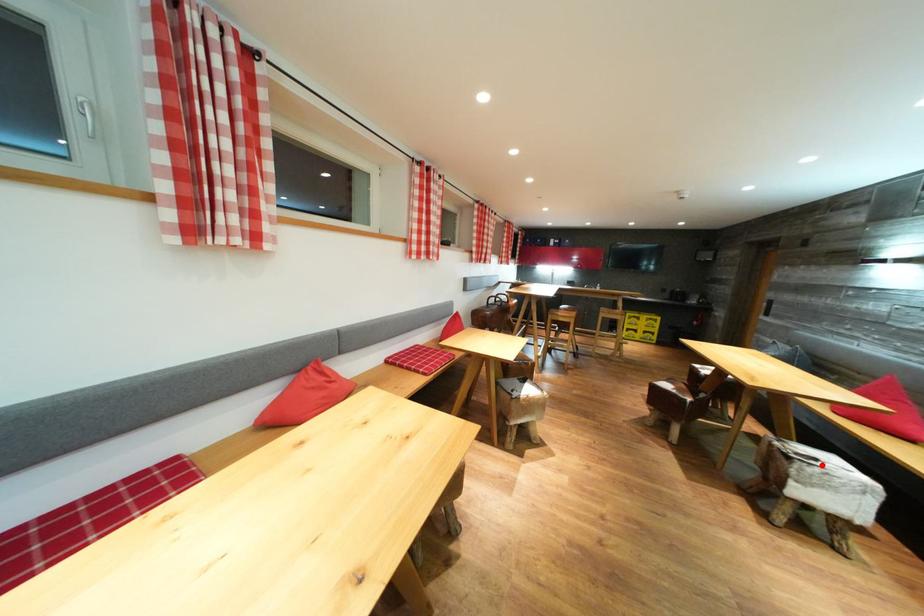
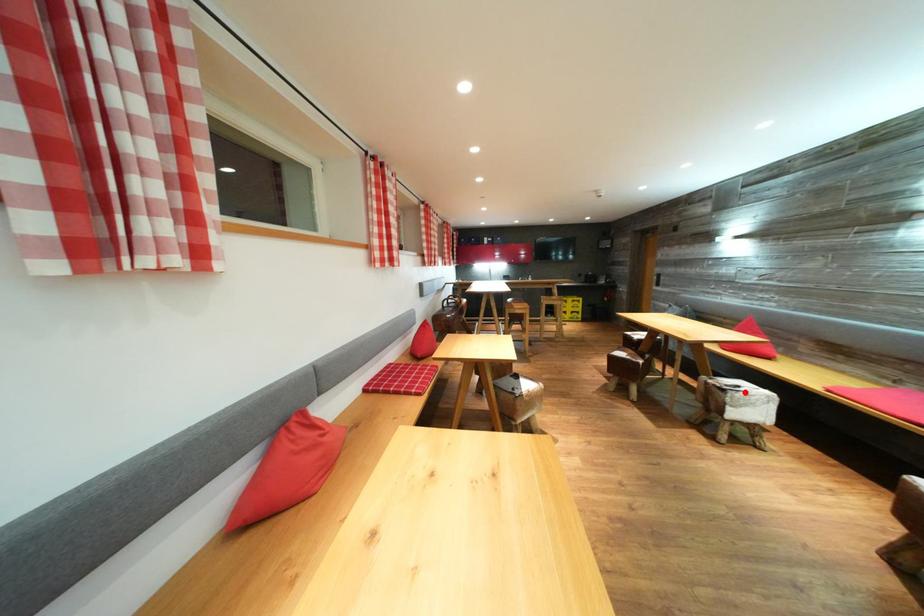
I am providing you with two images of the same scene from different viewpoints. A red point is marked on the first image and another point is marked on the second image. Does the point marked in image1 correspond to the same location as the one in image2?

Yes